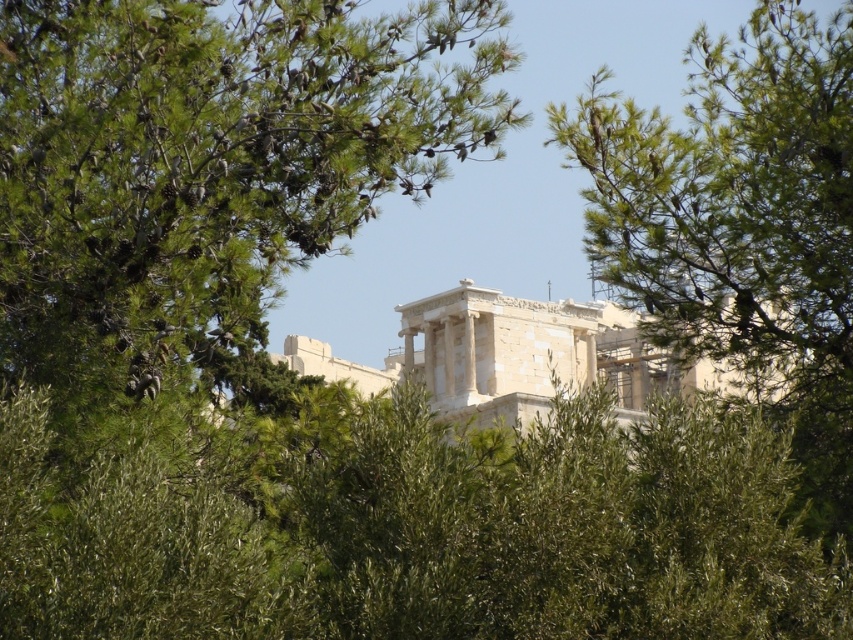
Question: Is green pinecone at center to the left of green leafy tree at upper right from the viewer's perspective?

Choices:
 (A) no
 (B) yes

Answer: (B)

Question: Which object appears closest to the camera in this image?

Choices:
 (A) green leafy tree at upper right
 (B) green pinecone at center

Answer: (B)

Question: Which point is closer to the camera taking this photo?

Choices:
 (A) (618, 177)
 (B) (177, 216)

Answer: (B)

Question: Which object is closer to the camera taking this photo?

Choices:
 (A) green leafy tree at upper right
 (B) green pinecone at center

Answer: (B)

Question: Can you confirm if green pinecone at center is positioned to the left of green leafy tree at upper right?

Choices:
 (A) no
 (B) yes

Answer: (B)

Question: Is green pinecone at center to the right of green leafy tree at upper right from the viewer's perspective?

Choices:
 (A) no
 (B) yes

Answer: (A)